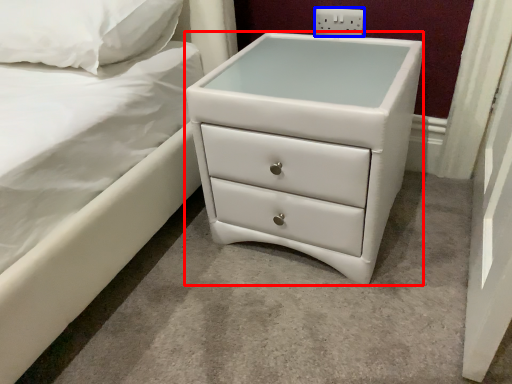
Question: Which object is further to the camera taking this photo, chest of drawers (highlighted by a red box) or electric outlet (highlighted by a blue box)?

Choices:
 (A) chest of drawers
 (B) electric outlet

Answer: (B)